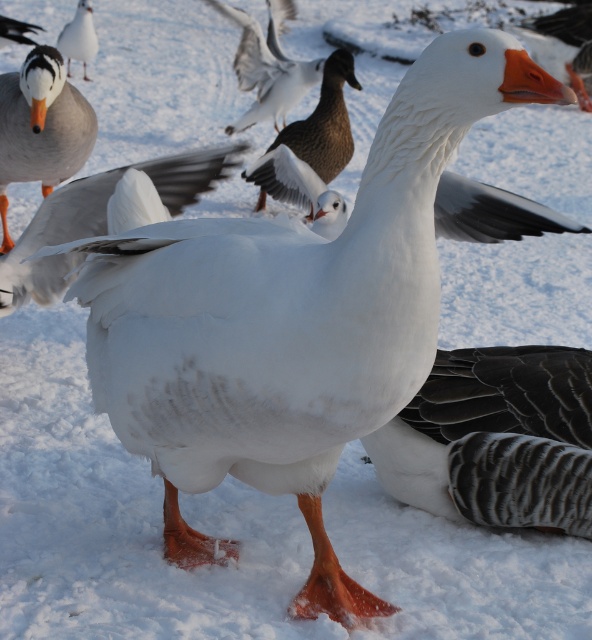
You are a wildlife photographer aiming to capture the brown matte duck at center in the image. The coordinates provided are point (326, 122). Based on the scene description, where should you focus your camera to ensure the brown matte duck at center is in the center of your frame?

The coordinates point (326, 122) indicate the location of the brown matte duck at center. To center the brown matte duck at center in your frame, you should focus your camera at the coordinates point (326, 122).

You are a photographer trying to capture a clear shot of both the brown matte duck at center and the white matte goose at upper left. Based on their positions, which one will appear closer to the camera in the photo?

The brown matte duck at center will appear closer to the camera in the photo because it is positioned in front of the white matte goose at upper left.

You are observing the image and want to locate the dark gray textured wing at lower right. Based on the coordinates provided, can you determine its position relative to the center of the image?

The dark gray textured wing at lower right is located at coordinates point (496, 438), which places it to the right and slightly below the center of the image.